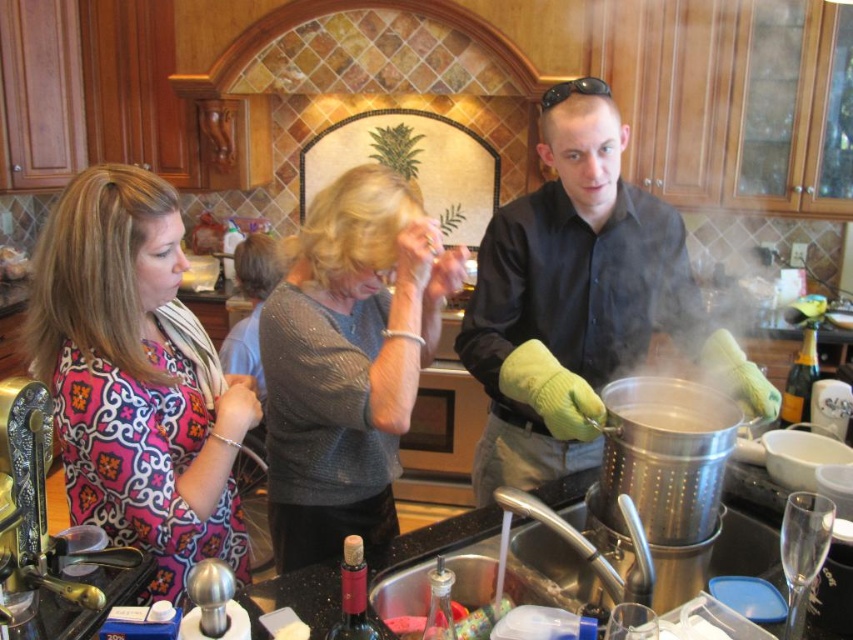
This screenshot has width=853, height=640. Describe the element at coordinates (569, 294) in the screenshot. I see `matte black shirt at center` at that location.

Is matte black shirt at center bigger than sparkly gray sweater at center?

Correct, matte black shirt at center is larger in size than sparkly gray sweater at center.

Between point (613, 218) and point (267, 433), which one is positioned in front?

Positioned in front is point (267, 433).

I want to click on matte black shirt at center, so click(569, 294).

Is pink patterned blouse at left further to the viewer compared to matte black shirt at center?

No, pink patterned blouse at left is in front of matte black shirt at center.

Is point (93, 173) positioned after point (503, 440)?

No, (93, 173) is closer to viewer.

At what (x,y) coordinates should I click in order to perform the action: click on pink patterned blouse at left. Please return your answer as a coordinate pair (x, y). The image size is (853, 640). Looking at the image, I should click on (136, 378).

From the picture: Between pink patterned blouse at left and sparkly gray sweater at center, which one is positioned lower?

Positioned lower is pink patterned blouse at left.

Who is more forward, (70,252) or (418,362)?

Positioned in front is point (70,252).

Find the location of a particular element. The image size is (853, 640). pink patterned blouse at left is located at coordinates (136, 378).